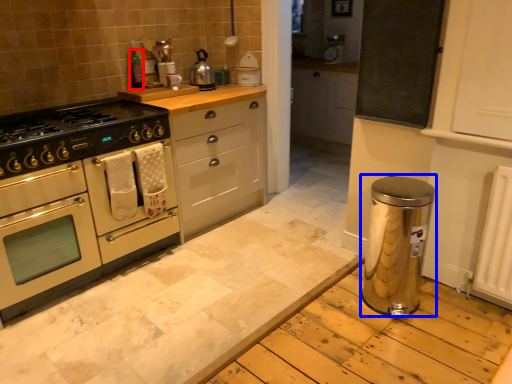
Question: Among these objects, which one is nearest to the camera, bottle (highlighted by a red box) or water heater (highlighted by a blue box)?

Choices:
 (A) bottle
 (B) water heater

Answer: (B)